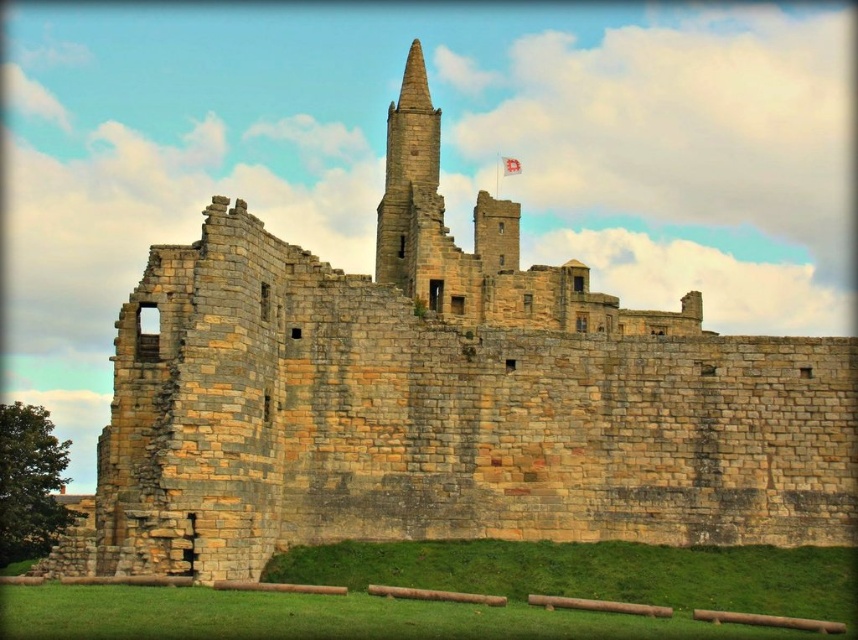
Consider the image. Is stone spire at center wider than white fabric flag at upper center?

Indeed, stone spire at center has a greater width compared to white fabric flag at upper center.

Which is more to the right, stone spire at center or white fabric flag at upper center?

white fabric flag at upper center is more to the right.

In order to click on stone spire at center in this screenshot , I will do `click(405, 163)`.